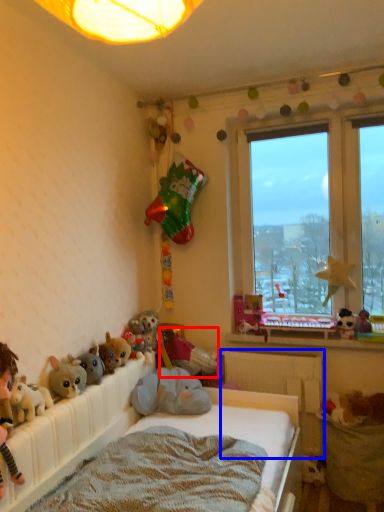
Question: Among these objects, which one is farthest to the camera, toy (highlighted by a red box) or radiator (highlighted by a blue box)?

Choices:
 (A) toy
 (B) radiator

Answer: (A)